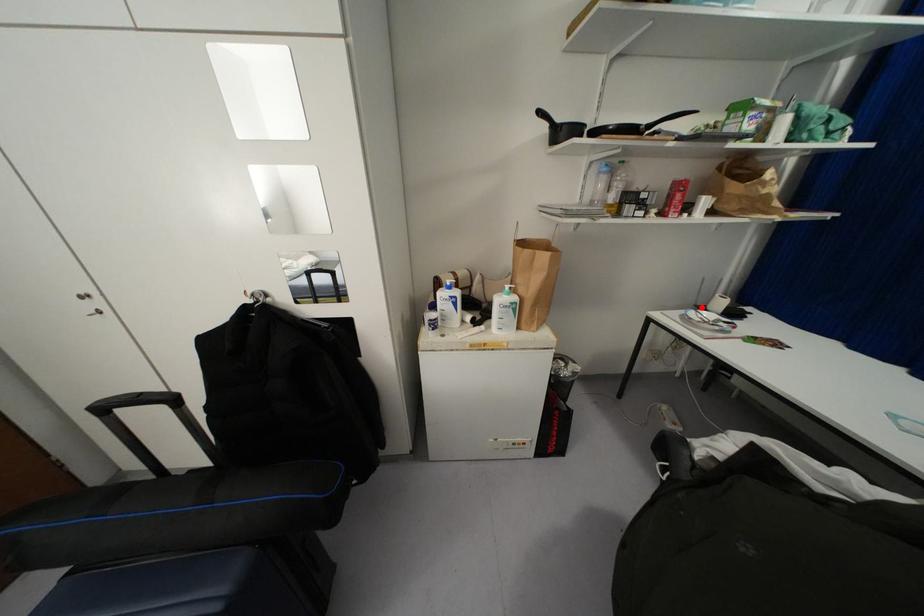
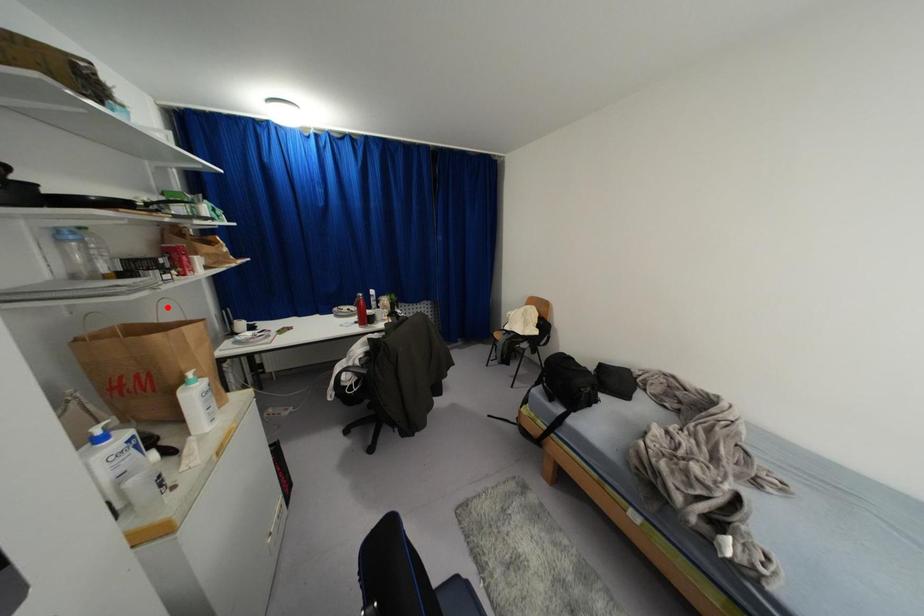
I am providing you with two images of the same scene from different viewpoints. A red point is marked on the first image and another point is marked on the second image. Are the points marked in image1 and image2 representing the same 3D position?

No